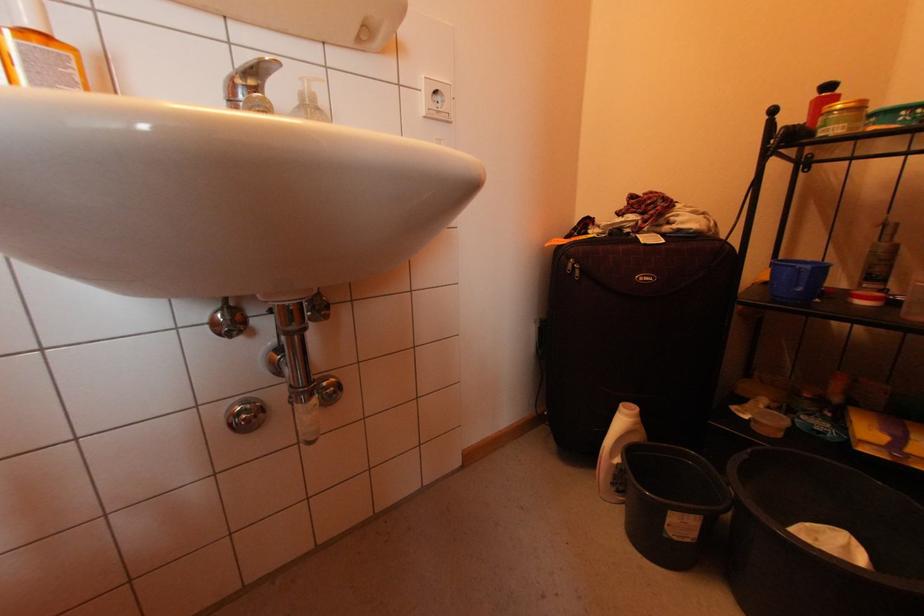
Where is `small black bucket`? The image size is (924, 616). small black bucket is located at coordinates (671, 503).